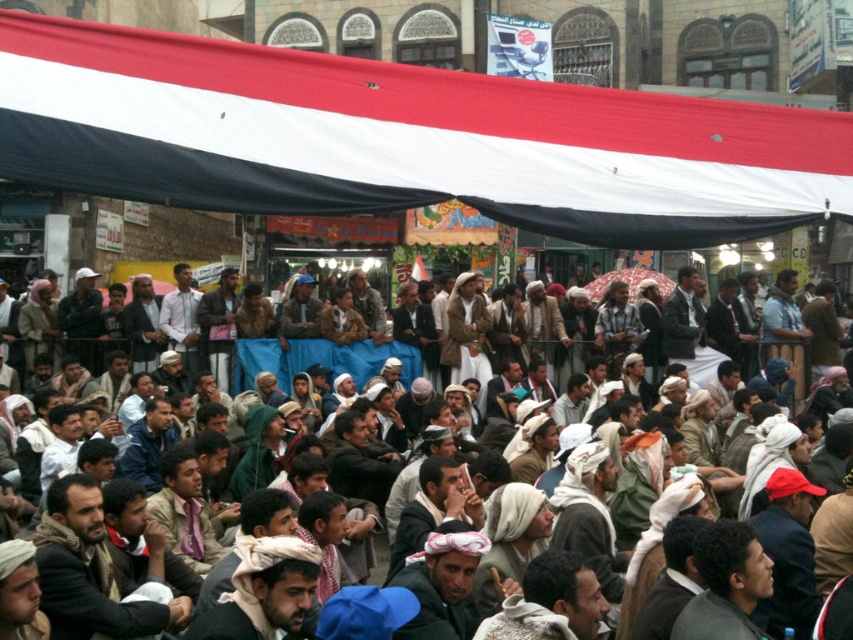
Question: Which of the following is the closest to the observer?

Choices:
 (A) red-white-black fabric at upper center
 (B) brown textured clothing at lower center

Answer: (B)

Question: Can you confirm if red-white-black fabric at upper center is positioned to the right of brown textured clothing at lower center?

Choices:
 (A) yes
 (B) no

Answer: (B)

Question: Considering the relative positions of red-white-black fabric at upper center and brown textured clothing at lower center in the image provided, where is red-white-black fabric at upper center located with respect to brown textured clothing at lower center?

Choices:
 (A) left
 (B) right

Answer: (A)

Question: Which point is closer to the camera taking this photo?

Choices:
 (A) (833, 435)
 (B) (541, 177)

Answer: (A)

Question: Does red-white-black fabric at upper center appear over brown textured clothing at lower center?

Choices:
 (A) yes
 (B) no

Answer: (A)

Question: Which point is farther to the camera?

Choices:
 (A) (389, 188)
 (B) (758, 506)

Answer: (A)